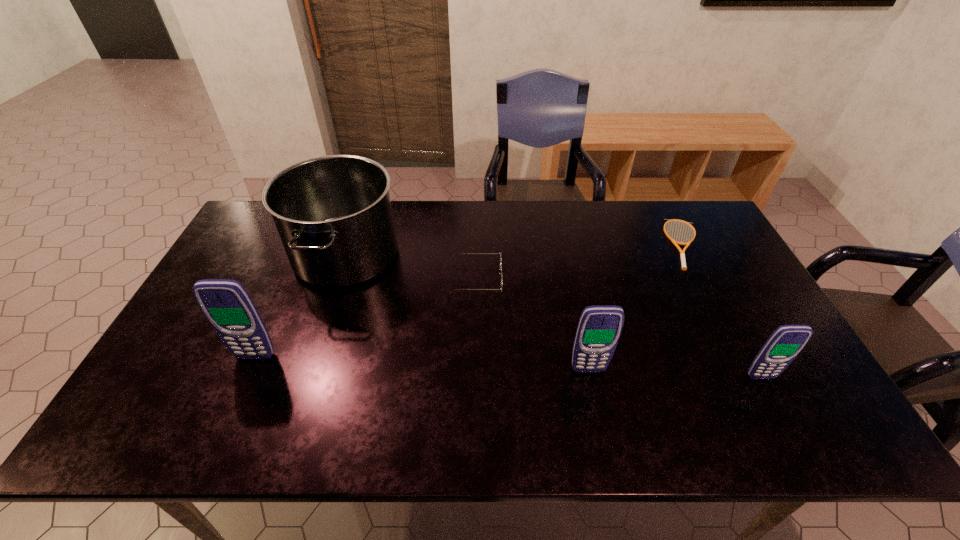
The width and height of the screenshot is (960, 540). I want to click on empty space that is in between the second shortest object and the saucepan, so click(411, 267).

Locate an element on the screen. The width and height of the screenshot is (960, 540). unoccupied area between the saucepan and the third object from left to right is located at coordinates (411, 267).

You are a GUI agent. You are given a task and a screenshot of the screen. Output one action in this format:
    pyautogui.click(x=<x>, y=<y>)
    Task: Click on the free space that is in between the shortest object and the nearest object
    The image size is (960, 540).
    Given the screenshot: What is the action you would take?
    pyautogui.click(x=724, y=310)

Locate an element on the screen. free spot between the shortest cellular telephone and the leftmost cellular telephone is located at coordinates (508, 367).

Choose which object is the nearest neighbor to the fourth tallest object. Please provide its 2D coordinates. Your answer should be formatted as a tuple, i.e. [(x, y)], where the tuple contains the x and y coordinates of a point satisfying the conditions above.

[(599, 328)]

Where is `object that stands as the closest to the saucepan`? Image resolution: width=960 pixels, height=540 pixels. object that stands as the closest to the saucepan is located at coordinates (227, 305).

Locate which cellular telephone is the third closest to the fourth object from right to left. Please provide its 2D coordinates. Your answer should be formatted as a tuple, i.e. [(x, y)], where the tuple contains the x and y coordinates of a point satisfying the conditions above.

[(785, 343)]

Identify the location of cellular telephone object that ranks as the closest to the leftmost cellular telephone. Image resolution: width=960 pixels, height=540 pixels. (599, 328).

You are a GUI agent. You are given a task and a screenshot of the screen. Output one action in this format:
    pyautogui.click(x=<x>, y=<y>)
    Task: Click on the free space in the image that satisfies the following two spatial constraints: 1. on the front side of the tennis racket; 2. on the front-facing side of the sunglasses
    Image resolution: width=960 pixels, height=540 pixels.
    Given the screenshot: What is the action you would take?
    pyautogui.click(x=705, y=279)